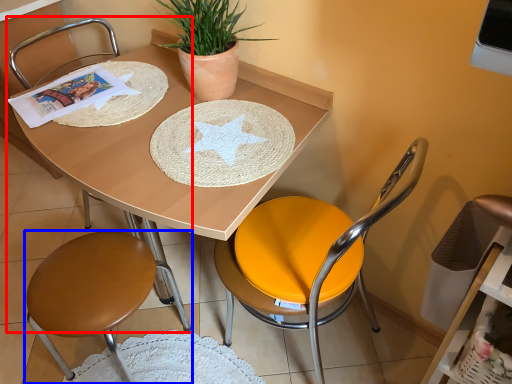
Question: Which object is closer to the camera taking this photo, chair (highlighted by a red box) or chair (highlighted by a blue box)?

Choices:
 (A) chair
 (B) chair

Answer: (B)